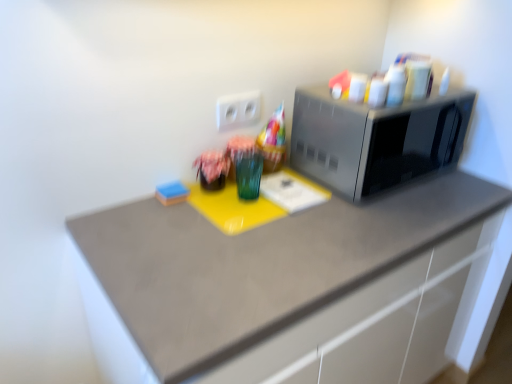
The width and height of the screenshot is (512, 384). I want to click on vacant area that is situated to the right of green glass at center, so click(x=318, y=220).